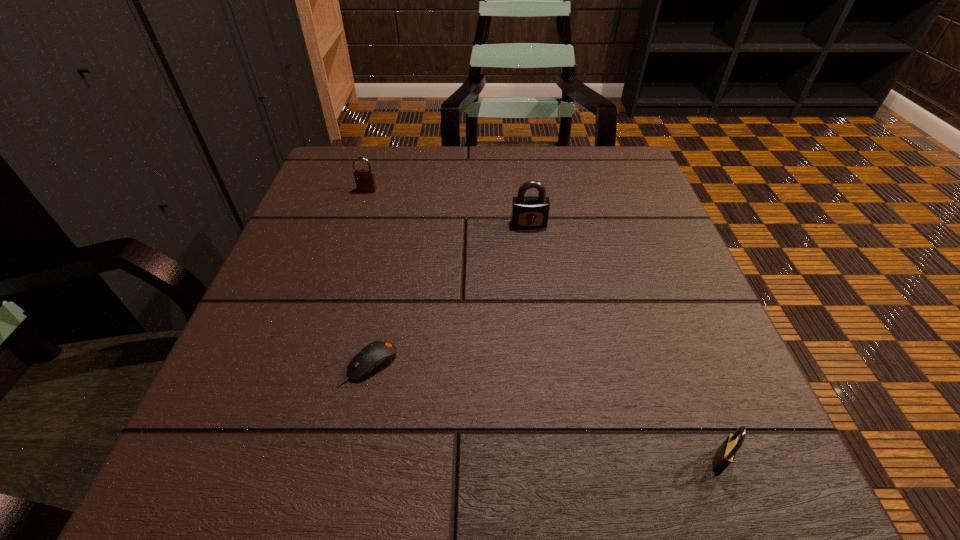
This screenshot has height=540, width=960. What are the coordinates of `free point located 0.270m on the back of the nearest padlock` in the screenshot? It's located at (659, 300).

You are a GUI agent. You are given a task and a screenshot of the screen. Output one action in this format:
    pyautogui.click(x=<x>, y=<y>)
    Task: Click on the vacant space located on the back of the second object from left to right
    The image size is (960, 540).
    Given the screenshot: What is the action you would take?
    pyautogui.click(x=398, y=226)

Find the location of a particular element. Image resolution: width=960 pixels, height=540 pixels. object at the far edge is located at coordinates click(x=365, y=180).

At what (x,y) coordinates should I click in order to perform the action: click on object that is at the near edge. Please return your answer as a coordinate pair (x, y). Image resolution: width=960 pixels, height=540 pixels. Looking at the image, I should click on (725, 454).

I want to click on object that is at the left edge, so click(365, 180).

The height and width of the screenshot is (540, 960). What are the coordinates of `object at the right edge` in the screenshot? It's located at (725, 454).

The height and width of the screenshot is (540, 960). I want to click on object positioned at the far left corner, so click(x=365, y=180).

Where is `object that is positioned at the near right corner`? object that is positioned at the near right corner is located at coordinates (725, 454).

This screenshot has width=960, height=540. I want to click on vacant space at the far edge of the desktop, so click(x=465, y=174).

This screenshot has height=540, width=960. In order to click on free space at the near edge in this screenshot , I will do `click(307, 472)`.